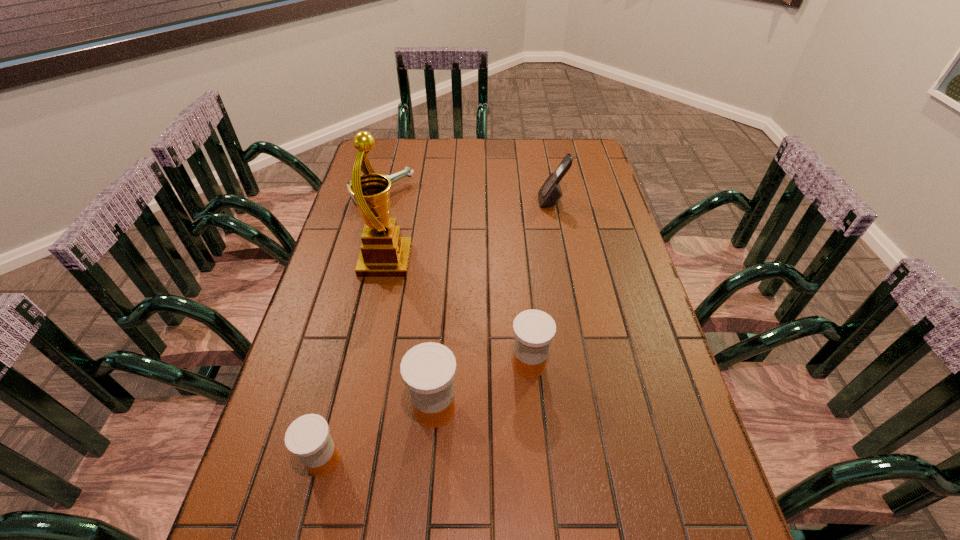
Find the location of a particular element. The height and width of the screenshot is (540, 960). vacant space that satisfies the following two spatial constraints: 1. on the front-facing side of the rightmost object; 2. on the label of the shortest medicine is located at coordinates (601, 461).